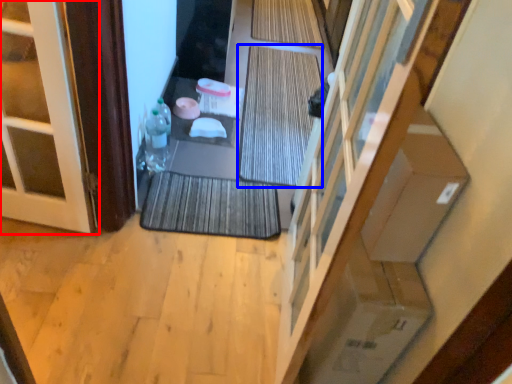
Question: Among these objects, which one is farthest to the camera, door (highlighted by a red box) or bath mat (highlighted by a blue box)?

Choices:
 (A) door
 (B) bath mat

Answer: (B)